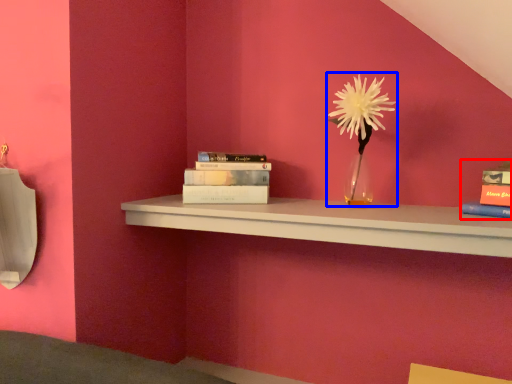
Question: Which point is further to the camera, book (highlighted by a red box) or floral arrangement (highlighted by a blue box)?

Choices:
 (A) book
 (B) floral arrangement

Answer: (B)